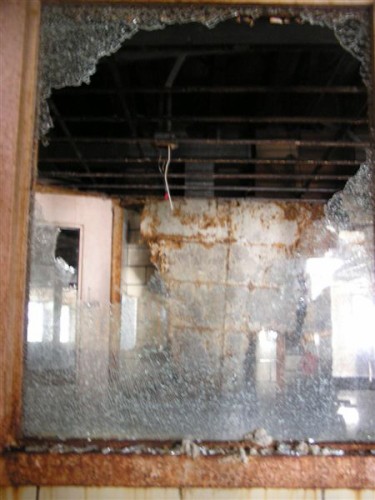
Identify the location of bottom edge of white wall. This screenshot has height=500, width=375. (29, 492), (119, 494), (241, 492), (336, 494).